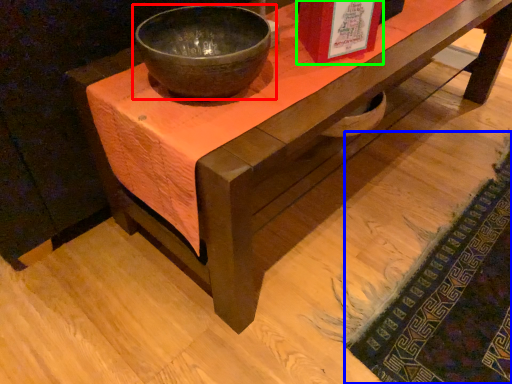
Question: Considering the real-world distances, which object is farthest from bowl (highlighted by a red box)? mat (highlighted by a blue box) or book cover (highlighted by a green box)?

Choices:
 (A) mat
 (B) book cover

Answer: (A)